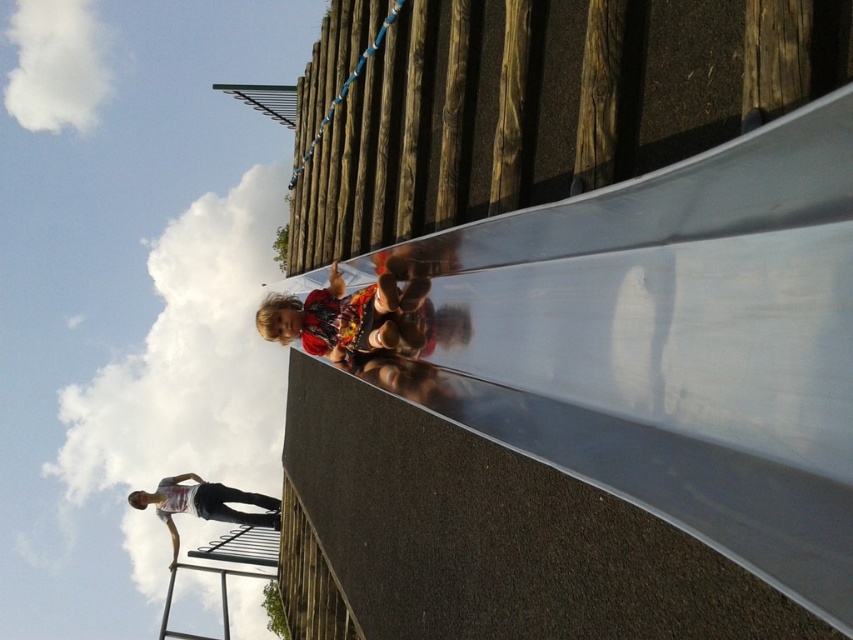
Question: Is white cotton tank top at upper left further to camera compared to metallic silver ladder at lower left?

Choices:
 (A) no
 (B) yes

Answer: (B)

Question: Which of the following is the closest to the observer?

Choices:
 (A) (274, 544)
 (B) (381, 282)

Answer: (B)

Question: Which object is farther from the camera taking this photo?

Choices:
 (A) metallic silver ladder at lower left
 (B) white cotton tank top at upper left
 (C) matte red shirt at center

Answer: (B)

Question: Can you confirm if matte red shirt at center is thinner than white cotton tank top at upper left?

Choices:
 (A) yes
 (B) no

Answer: (A)

Question: Considering the relative positions of matte red shirt at center and white cotton tank top at upper left in the image provided, where is matte red shirt at center located with respect to white cotton tank top at upper left?

Choices:
 (A) above
 (B) below

Answer: (A)

Question: Considering the real-world distances, which object is farthest from the matte red shirt at center?

Choices:
 (A) metallic silver ladder at lower left
 (B) white cotton tank top at upper left

Answer: (B)